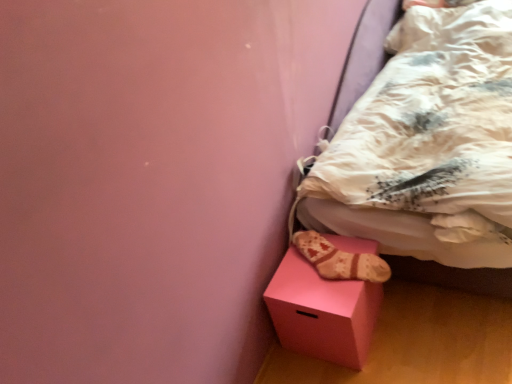
Question: Based on their sizes in the image, would you say white textured bed at lower right is bigger or smaller than pink matte cube at lower right?

Choices:
 (A) big
 (B) small

Answer: (A)

Question: Considering the positions of white textured bed at lower right and pink matte cube at lower right in the image, is white textured bed at lower right wider or thinner than pink matte cube at lower right?

Choices:
 (A) thin
 (B) wide

Answer: (B)

Question: Which object is the farthest from the white textured bed at lower right?

Choices:
 (A) pink matte cube at lower right
 (B) beige fabric sock at lower right

Answer: (B)

Question: Considering the real-world distances, which object is closest to the white textured bed at lower right?

Choices:
 (A) pink matte cube at lower right
 (B) beige fabric sock at lower right

Answer: (A)